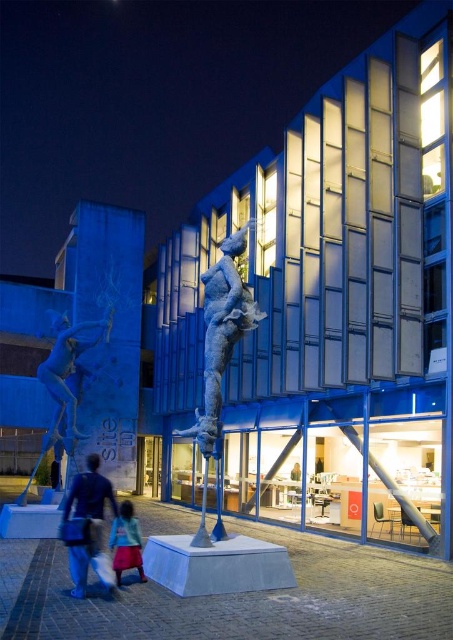
Question: Observing the image, what is the correct spatial positioning of blue metallic statue at left in reference to blue fabric bag at lower left?

Choices:
 (A) right
 (B) left

Answer: (B)

Question: Estimate the real-world distances between objects in this image. Which object is closer to the blue fabric bag at lower left?

Choices:
 (A) blue metallic statue at center
 (B) blue metallic statue at left
 (C) light blue denim pants at lower center

Answer: (C)

Question: Where is blue metallic statue at center located in relation to blue fabric bag at lower left in the image?

Choices:
 (A) right
 (B) left

Answer: (A)

Question: Which object appears closest to the camera in this image?

Choices:
 (A) blue metallic statue at left
 (B) blue fabric bag at lower left

Answer: (B)

Question: Among these points, which one is farthest from the camera?

Choices:
 (A) (106, 566)
 (B) (234, 330)

Answer: (B)

Question: Is the position of blue fabric bag at lower left less distant than that of light blue denim pants at lower center?

Choices:
 (A) no
 (B) yes

Answer: (B)